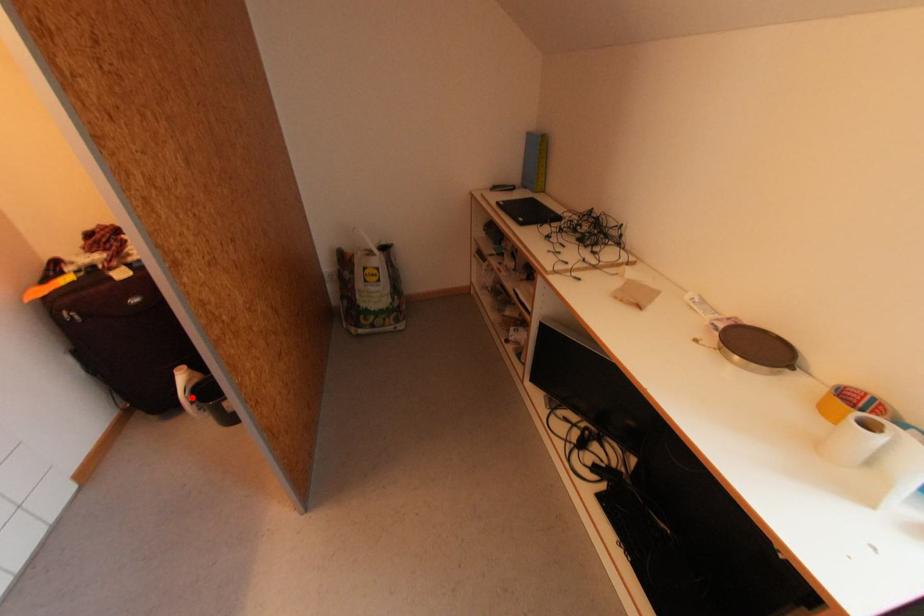
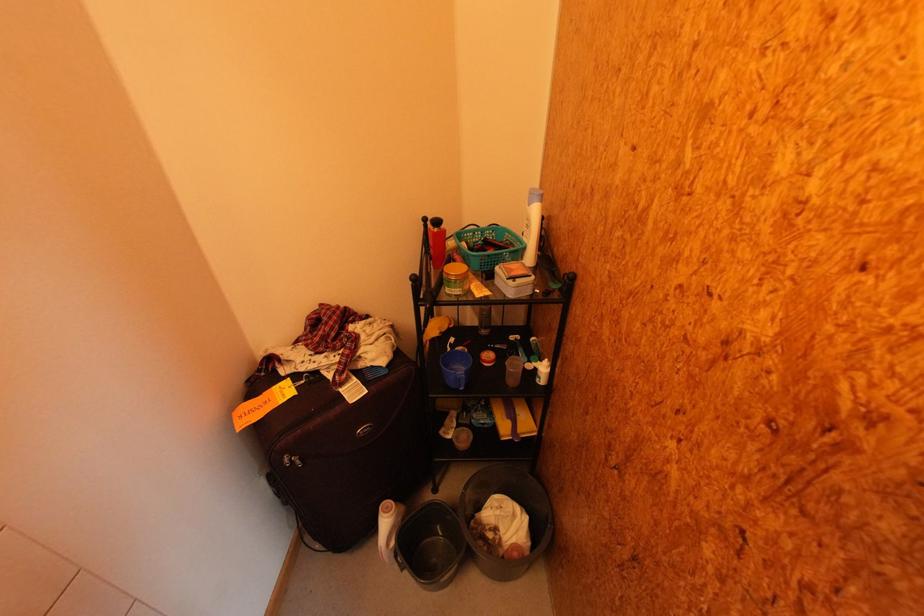
Find the pixel in the second image that matches the highlighted location in the first image.

(393, 546)